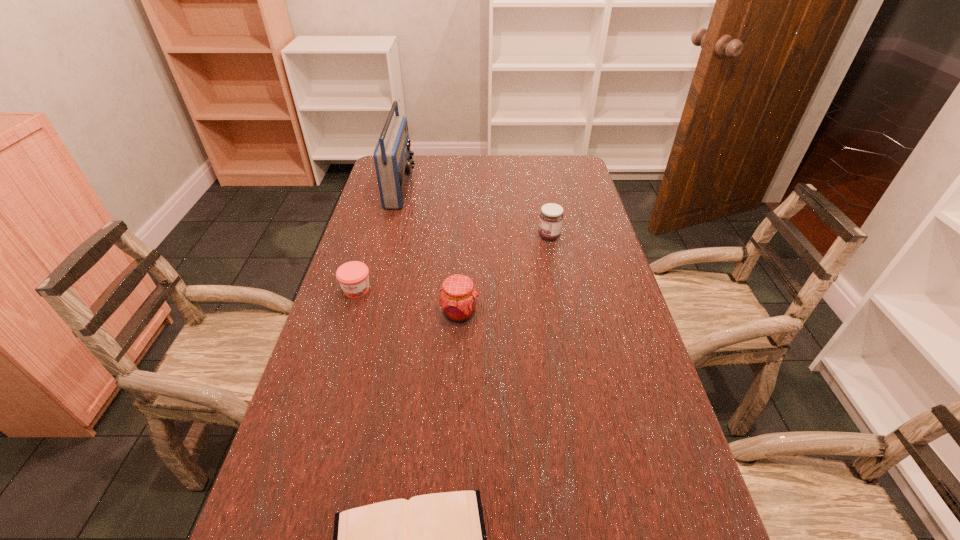
The image size is (960, 540). I want to click on blank space at the right edge, so click(x=588, y=325).

The image size is (960, 540). Identify the location of vacant point at the far right corner. (564, 170).

Where is `free point between the leftmost jam and the radio receiver`? This screenshot has height=540, width=960. free point between the leftmost jam and the radio receiver is located at coordinates (378, 239).

I want to click on free spot between the second jam from right to left and the rightmost jam, so click(504, 275).

Where is `vacant space that's between the rightmost jam and the fourth tallest object`? This screenshot has height=540, width=960. vacant space that's between the rightmost jam and the fourth tallest object is located at coordinates (453, 263).

This screenshot has width=960, height=540. What are the coordinates of `vacant region between the rightmost object and the fourth tallest object` in the screenshot? It's located at (453, 263).

Locate an element on the screen. free space between the farthest object and the rightmost jam is located at coordinates (474, 212).

Where is `the third closest object to the hardback book`? The width and height of the screenshot is (960, 540). the third closest object to the hardback book is located at coordinates (551, 216).

Locate an element on the screen. The width and height of the screenshot is (960, 540). object that stands as the closest to the shortest jam is located at coordinates (457, 299).

The image size is (960, 540). I want to click on jam that stands as the closest to the second shortest object, so click(457, 299).